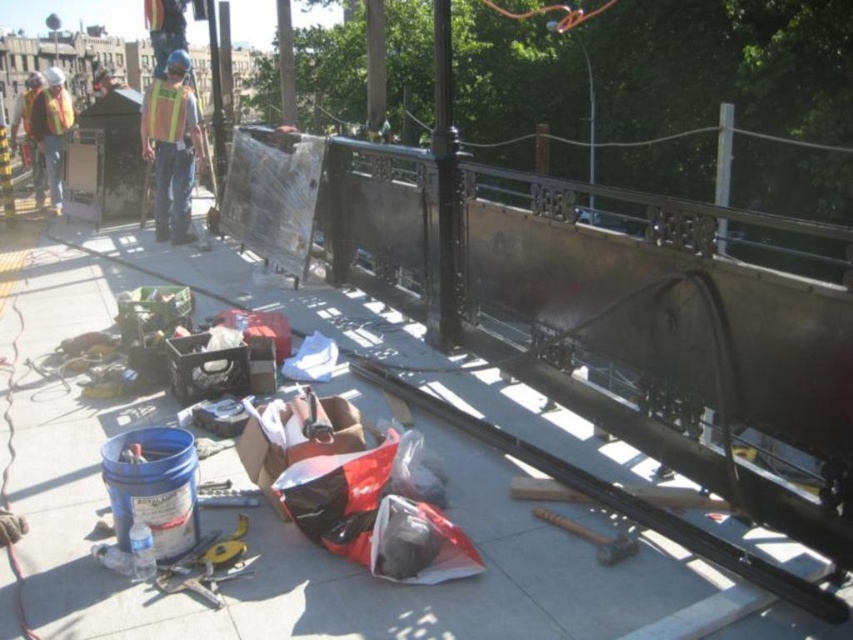
Question: Which point appears closest to the camera in this image?

Choices:
 (A) (44, 385)
 (B) (32, 116)

Answer: (A)

Question: Does yellow reflective vest at center have a larger size compared to reflective safety vest at left?

Choices:
 (A) no
 (B) yes

Answer: (A)

Question: Is metallic gray pavement at center behind reflective safety vest at left?

Choices:
 (A) no
 (B) yes

Answer: (A)

Question: Which point appears closest to the camera in this image?

Choices:
 (A) (45, 172)
 (B) (170, 154)
 (C) (180, 522)

Answer: (C)

Question: Which object is closer to the camera taking this photo?

Choices:
 (A) plastic bucket at lower left
 (B) metallic gray pavement at center

Answer: (B)

Question: Is plastic bucket at lower left to the left of reflective safety vest at left from the viewer's perspective?

Choices:
 (A) no
 (B) yes

Answer: (A)